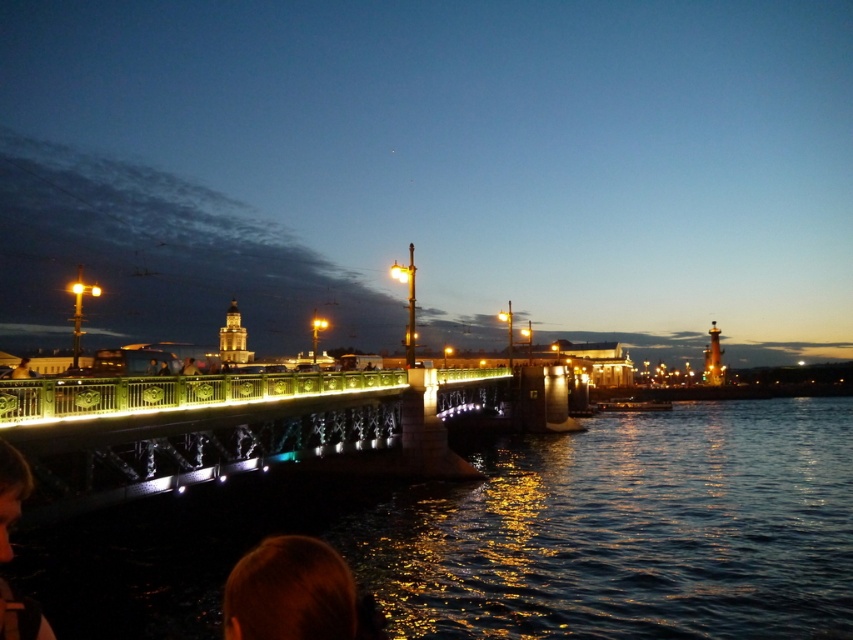
You are standing on the bridge in the image and notice a point marked at coordinates (289,593). What is located at this point?

The point at coordinates (289,593) marks brown hair at lower center.